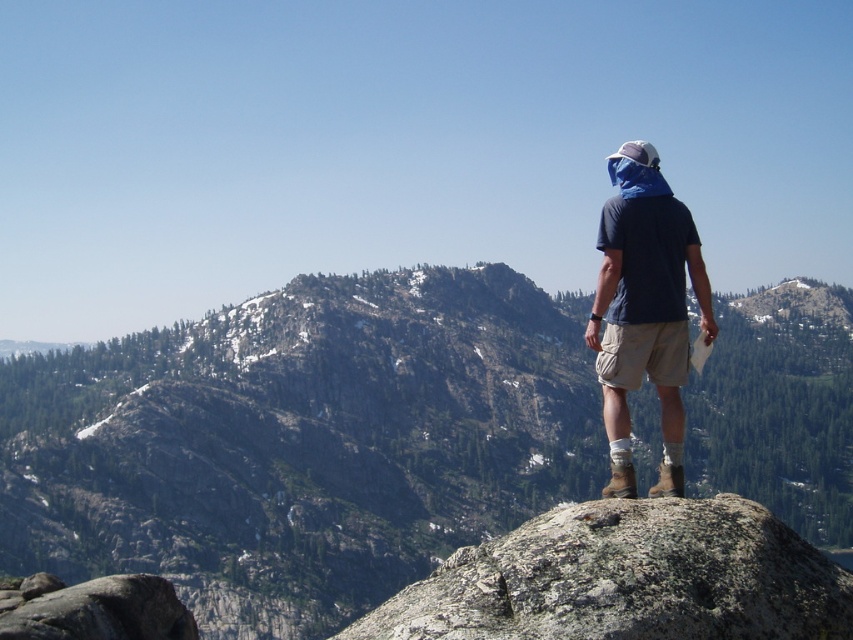
Question: Is green textured rock at center below gray rough rock at center?

Choices:
 (A) yes
 (B) no

Answer: (B)

Question: Which of these objects is positioned farthest from the green textured rock at center?

Choices:
 (A) gray rough rock at center
 (B) gray rock at lower left
 (C) blue fabric hat at upper right

Answer: (A)

Question: In this image, where is blue fabric hat at upper right located relative to gray rock at lower left?

Choices:
 (A) right
 (B) left

Answer: (A)

Question: Which of the following is the closest to the observer?

Choices:
 (A) green textured rock at center
 (B) gray rough rock at center
 (C) blue fabric hat at upper right
 (D) gray rock at lower left

Answer: (B)

Question: Among these points, which one is nearest to the camera?

Choices:
 (A) (607, 493)
 (B) (206, 513)
 (C) (71, 616)

Answer: (A)

Question: Is blue fabric hat at upper right below gray rock at lower left?

Choices:
 (A) yes
 (B) no

Answer: (B)